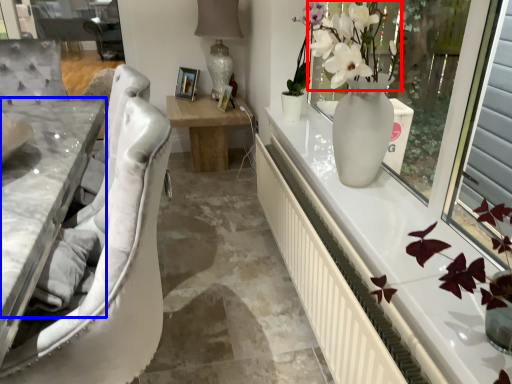
Question: Which object is further to the camera taking this photo, floral arrangement (highlighted by a red box) or counter top (highlighted by a blue box)?

Choices:
 (A) floral arrangement
 (B) counter top

Answer: (A)